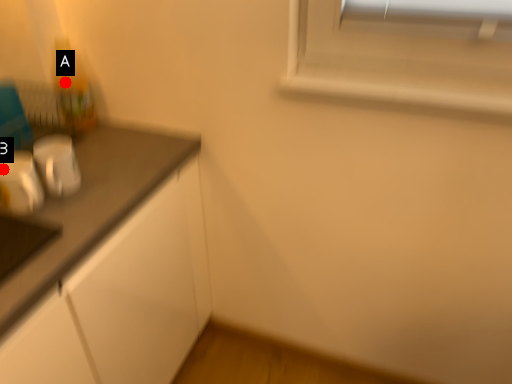
Question: Two points are circled on the image, labeled by A and B beside each circle. Which point is closer to the camera taking this photo?

Choices:
 (A) A is closer
 (B) B is closer

Answer: (B)